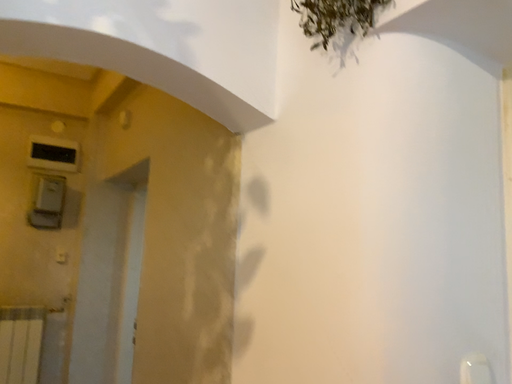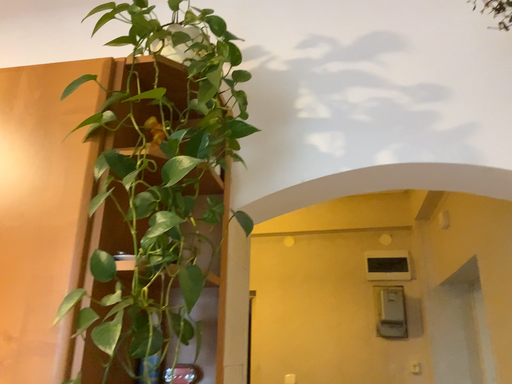
Question: How did the camera likely rotate when shooting the video?

Choices:
 (A) rotated left
 (B) rotated right

Answer: (A)